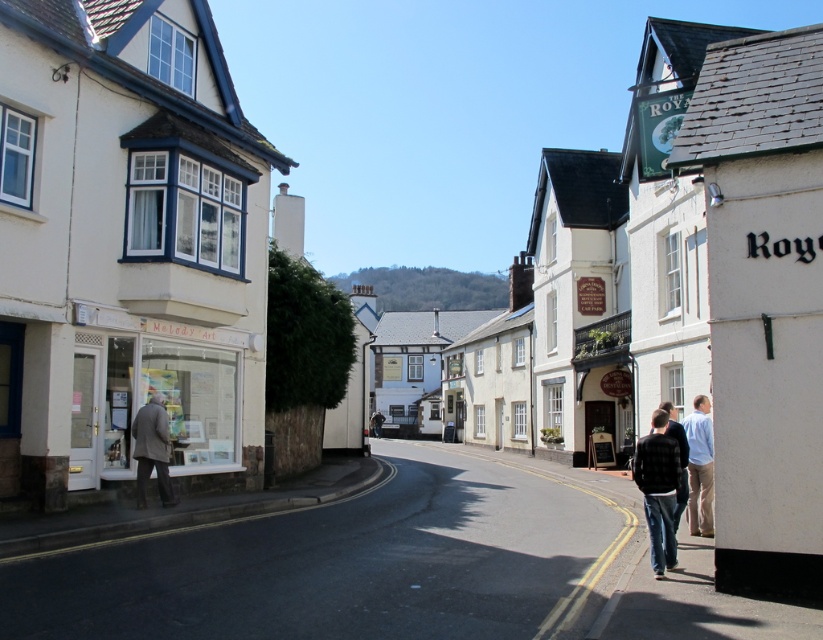
Who is shorter, black flannel shirt at lower right or black textured jacket at lower right?

With less height is black flannel shirt at lower right.

Is black flannel shirt at lower right bigger than black textured jacket at lower right?

Actually, black flannel shirt at lower right might be smaller than black textured jacket at lower right.

You are a GUI agent. You are given a task and a screenshot of the screen. Output one action in this format:
    pyautogui.click(x=<x>, y=<y>)
    Task: Click on the black flannel shirt at lower right
    
    Given the screenshot: What is the action you would take?
    pyautogui.click(x=663, y=484)

Where is `black flannel shirt at lower right`? The height and width of the screenshot is (640, 823). black flannel shirt at lower right is located at coordinates (663, 484).

Looking at this image, who is higher up, black flannel shirt at lower right or light brown wool coat at left?

Positioned higher is black flannel shirt at lower right.

Is point (656, 566) positioned before point (161, 433)?

Yes, point (656, 566) is in front of point (161, 433).

Who is more distant from viewer, (665, 545) or (159, 422)?

Point (159, 422)

This screenshot has width=823, height=640. In order to click on black flannel shirt at lower right in this screenshot , I will do `click(663, 484)`.

Can you confirm if black flannel shirt at lower right is thinner than light blue shirt at right?

Correct, black flannel shirt at lower right's width is less than light blue shirt at right's.

Between black flannel shirt at lower right and light blue shirt at right, which one is positioned higher?

black flannel shirt at lower right is higher up.

The height and width of the screenshot is (640, 823). Find the location of `black flannel shirt at lower right`. black flannel shirt at lower right is located at coordinates (663, 484).